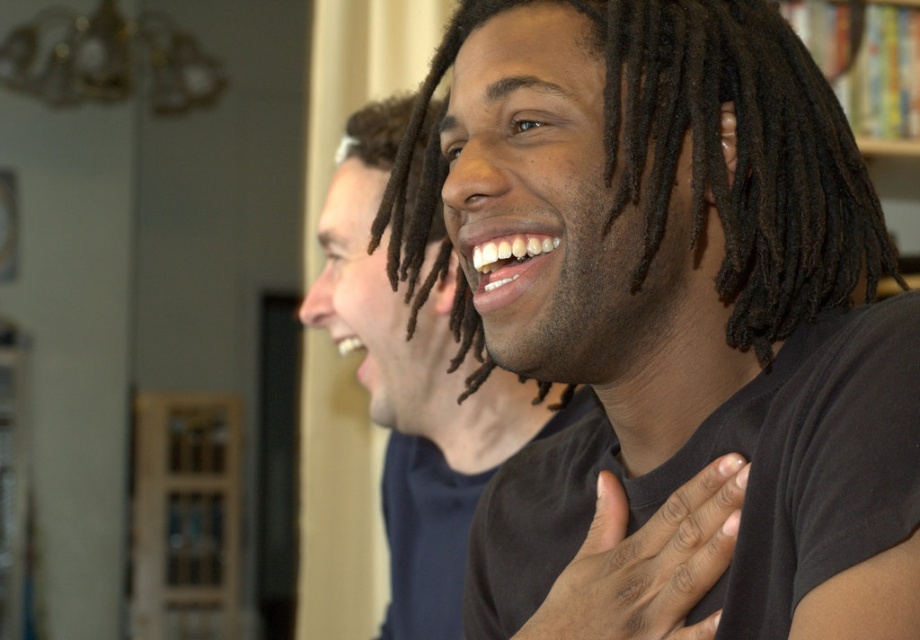
You are a photographer trying to capture a closeup of the dark brown dreadlocks at center and the black matte hand at center. Given their sizes, which one would you need to move closer to the camera to ensure both appear equally sized in the photo?

The dark brown dreadlocks at center is larger than the black matte hand at center. To make them appear equally sized in the photo, you would need to move the black matte hand at center closer to the camera since it is smaller and requires a closer proximity to match the size of the larger dreadlocks.